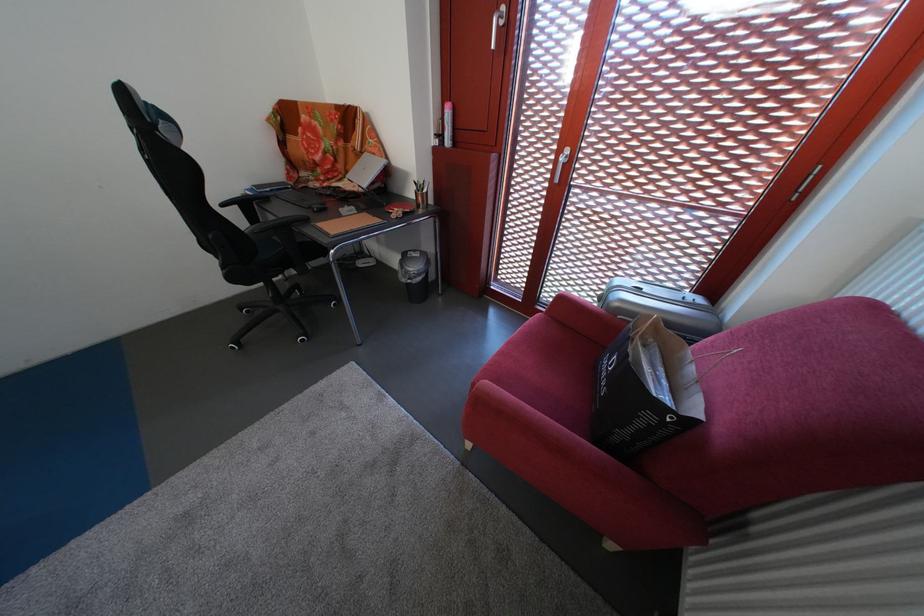
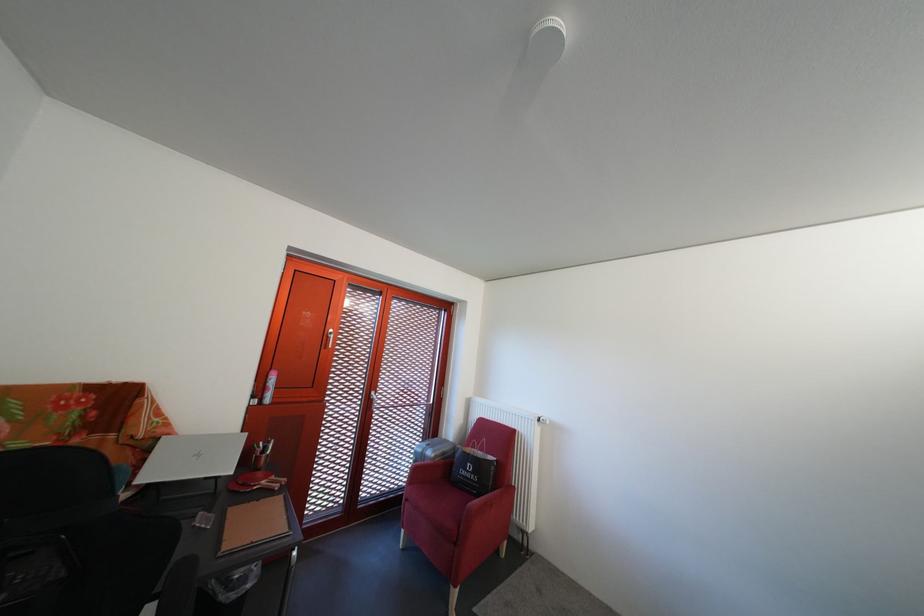
The point at (578, 158) is marked in the first image. Where is the corresponding point in the second image?

(383, 400)